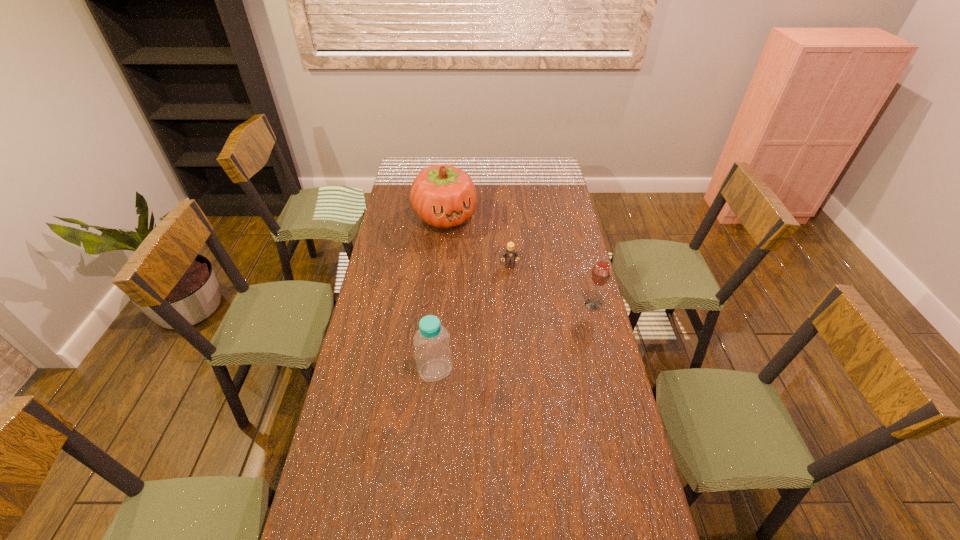
Where is `vacant space located 0.070m on the side of the pumpkin with the cute face`? The height and width of the screenshot is (540, 960). vacant space located 0.070m on the side of the pumpkin with the cute face is located at coordinates (461, 245).

Locate an element on the screen. free space located in front of the second farthest object is located at coordinates (521, 333).

Locate an element on the screen. The height and width of the screenshot is (540, 960). free space located in front of the second farthest object is located at coordinates (517, 310).

Locate an element on the screen. free space located 0.070m in front of the second farthest object is located at coordinates (513, 280).

I want to click on object at the left edge, so click(442, 195).

The image size is (960, 540). What are the coordinates of `object that is at the right edge` in the screenshot? It's located at 600,275.

Where is `vacant position at the far edge of the desktop`? vacant position at the far edge of the desktop is located at coordinates (527, 179).

Where is `free space at the left edge of the desktop`? free space at the left edge of the desktop is located at coordinates (396, 278).

This screenshot has width=960, height=540. In order to click on blank space at the right edge of the desktop in this screenshot , I will do (561, 228).

Identify the location of free space at the far left corner of the desktop. (409, 165).